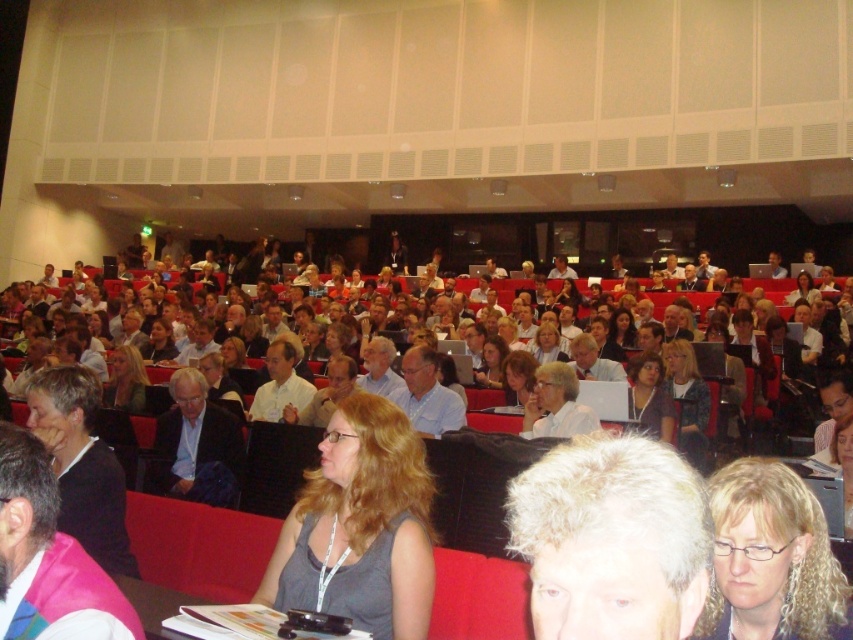
You are a photographer in the back of the lecture hall and want to take a photo of the person with gray curly hair at center and gray fabric shirt at center. Which object should you focus on first to ensure the photo is in sharp focus?

gray curly hair at center should be focused on first because it is smaller than gray fabric shirt at center, so focusing on the smaller object first will help ensure both are in sharp focus.